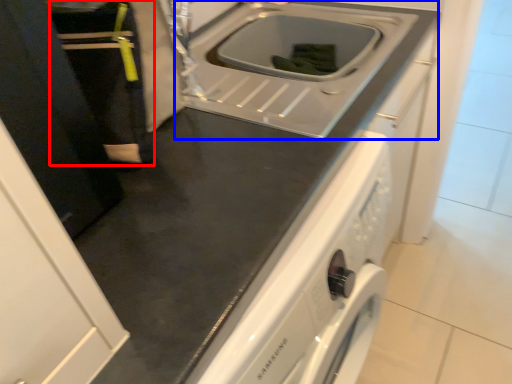
Question: Which object appears farthest to the camera in this image, person (highlighted by a red box) or sink (highlighted by a blue box)?

Choices:
 (A) person
 (B) sink

Answer: (B)